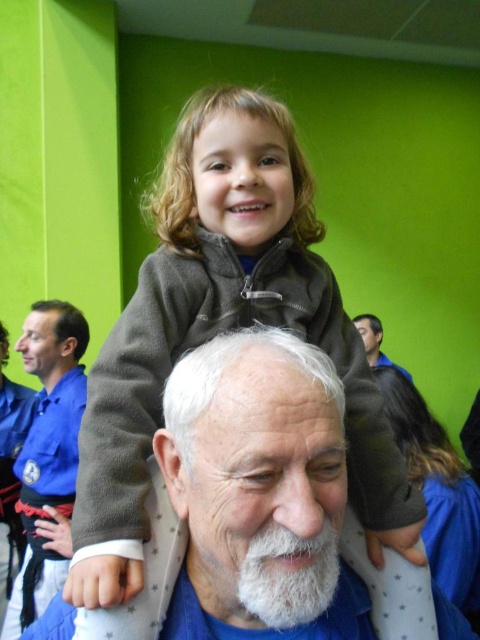
You are an observer standing in front of the scene. You need to determine which object is nearer to you between the matte gray jacket at center and the dark blue shirt at upper right. Can you figure it out?

The matte gray jacket at center is closer to the viewer than the dark blue shirt at upper right.

You are a photographer standing at the camera position. You need to take a photo of the scene, but you want to ensure that the subject at point (142,538) is in focus. What is the minimum distance you need to adjust your focus to capture this subject clearly?

The subject at point (142,538) is 28.98 inches away from the camera, so you need to adjust the focus to at least 28.98 inches to capture it clearly.

You are a photographer setting up for a group photo. You need to position two subjects so that they are exactly 8 feet apart for the shot. The subjects are wearing the matte gray jacket at center and the dark blue shirt at upper right. Based on the current distance between them, do you think they need to move closer or farther apart to achieve the required distance?

The matte gray jacket at center and dark blue shirt at upper right are currently 7.36 feet apart. To reach the required 8 feet, they need to move slightly farther apart.